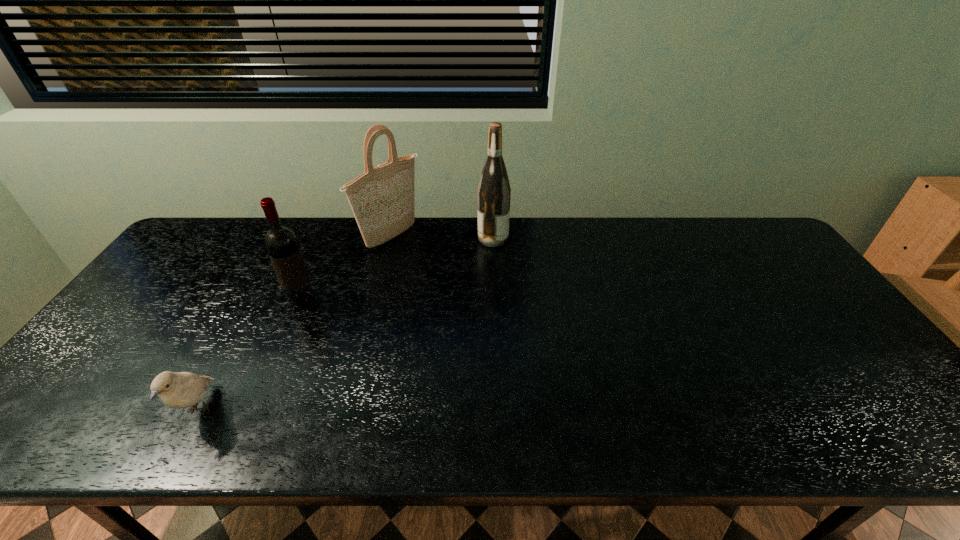
Where is `wine bottle at the far edge`? wine bottle at the far edge is located at coordinates (493, 194).

At what (x,y) coordinates should I click in order to perform the action: click on shopping bag at the far edge. Please return your answer as a coordinate pair (x, y). This screenshot has width=960, height=540. Looking at the image, I should click on (382, 199).

I want to click on object present at the near edge, so click(x=176, y=390).

Where is `vacant space at the far edge of the desktop`? The image size is (960, 540). vacant space at the far edge of the desktop is located at coordinates (251, 223).

You are a GUI agent. You are given a task and a screenshot of the screen. Output one action in this format:
    pyautogui.click(x=<x>, y=<y>)
    Task: Click on the free region at the near edge of the desktop
    The image size is (960, 540).
    Given the screenshot: What is the action you would take?
    pyautogui.click(x=308, y=446)

You are a GUI agent. You are given a task and a screenshot of the screen. Output one action in this format:
    pyautogui.click(x=<x>, y=<y>)
    Task: Click on the free spot at the left edge of the desktop
    The height and width of the screenshot is (540, 960).
    Given the screenshot: What is the action you would take?
    pyautogui.click(x=85, y=370)

What are the coordinates of `free spot between the nearest object and the right wine bottle` in the screenshot? It's located at (347, 324).

Image resolution: width=960 pixels, height=540 pixels. Find the location of `vacant point located between the bird and the third object from left to right`. vacant point located between the bird and the third object from left to right is located at coordinates (296, 323).

Image resolution: width=960 pixels, height=540 pixels. I want to click on vacant area that lies between the taller wine bottle and the second nearest object, so click(397, 269).

Find the location of `vacant space that is in between the third tallest object and the bird`. vacant space that is in between the third tallest object and the bird is located at coordinates (251, 355).